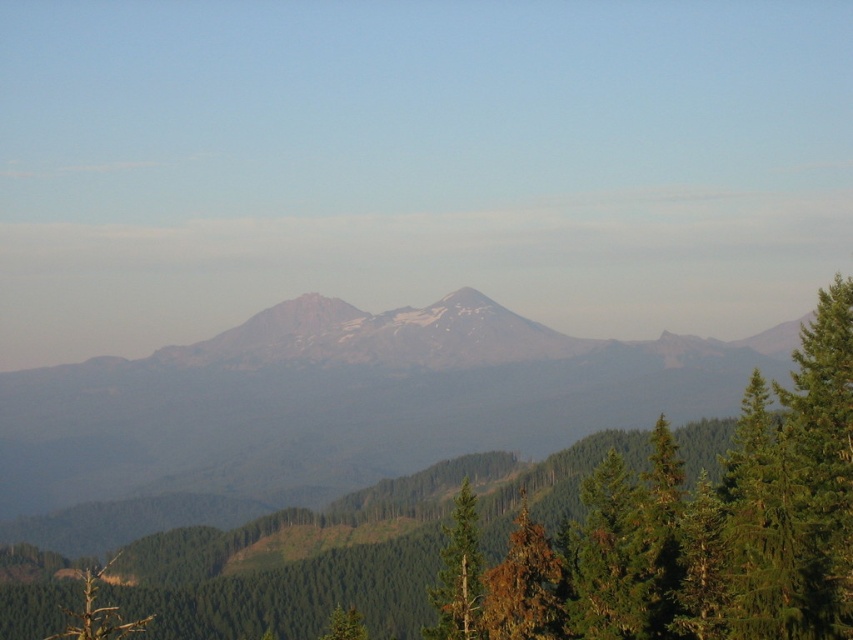
Question: Observing the image, what is the correct spatial positioning of brown/dried wood tree at center in reference to green matte tree at center?

Choices:
 (A) below
 (B) above

Answer: (B)

Question: Which is farther from the gray rocky mountain range at center?

Choices:
 (A) green textured tree at lower left
 (B) green matte tree at center
 (C) brown/dried wood tree at center

Answer: (C)

Question: Which point appears farthest from the camera in this image?

Choices:
 (A) (465, 419)
 (B) (548, 577)

Answer: (A)

Question: Is brown/dried wood tree at center bigger than green matte tree at center?

Choices:
 (A) no
 (B) yes

Answer: (A)

Question: Does brown/dried wood tree at center come in front of green matte tree at center?

Choices:
 (A) yes
 (B) no

Answer: (A)

Question: Among these points, which one is farthest from the camera?

Choices:
 (A) (514, 612)
 (B) (404, 452)
 (C) (469, 579)
 (D) (96, 593)

Answer: (B)